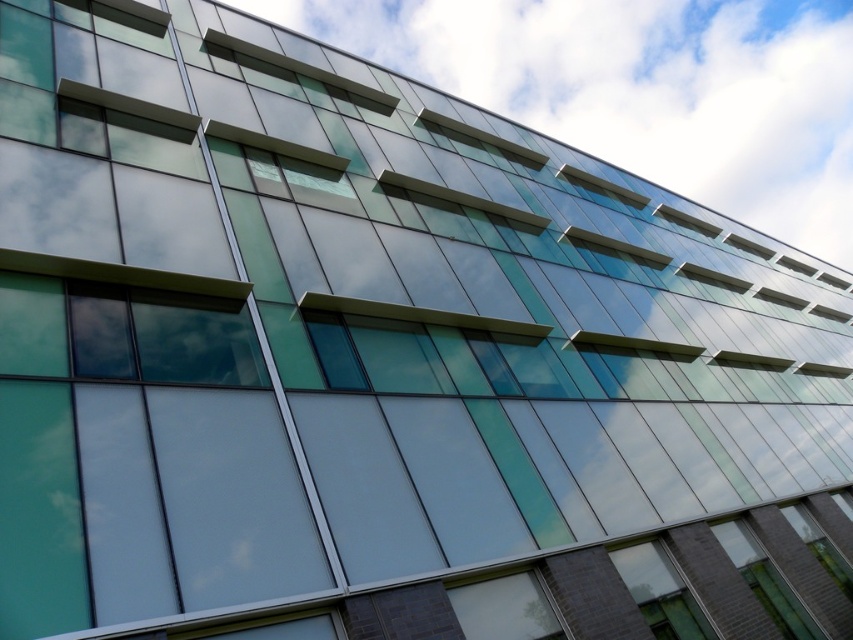
Based on the photo, who is shorter, transparent glass window at lower right or transparent glass window at upper center?

transparent glass window at upper center

Does transparent glass window at lower right have a larger size compared to transparent glass window at upper center?

Incorrect, transparent glass window at lower right is not larger than transparent glass window at upper center.

The height and width of the screenshot is (640, 853). What do you see at coordinates (660, 593) in the screenshot?
I see `transparent glass window at lower right` at bounding box center [660, 593].

You are a GUI agent. You are given a task and a screenshot of the screen. Output one action in this format:
    pyautogui.click(x=<x>, y=<y>)
    Task: Click on the transparent glass window at lower right
    
    Given the screenshot: What is the action you would take?
    pyautogui.click(x=660, y=593)

What do you see at coordinates (660, 593) in the screenshot? This screenshot has width=853, height=640. I see `transparent glass window at lower right` at bounding box center [660, 593].

Is transparent glass window at lower right to the right of transparent glass window at upper right from the viewer's perspective?

In fact, transparent glass window at lower right is to the left of transparent glass window at upper right.

Describe the element at coordinates (660, 593) in the screenshot. I see `transparent glass window at lower right` at that location.

This screenshot has width=853, height=640. In order to click on transparent glass window at lower right in this screenshot , I will do [660, 593].

Is point (601, 180) positioned in front of point (717, 232)?

Yes.

Can you confirm if transparent glass window at upper center is positioned to the right of transparent glass window at upper right?

In fact, transparent glass window at upper center is to the left of transparent glass window at upper right.

Locate an element on the screen. This screenshot has height=640, width=853. transparent glass window at upper center is located at coordinates (601, 186).

Find the location of a particular element. transparent glass window at upper center is located at coordinates (601, 186).